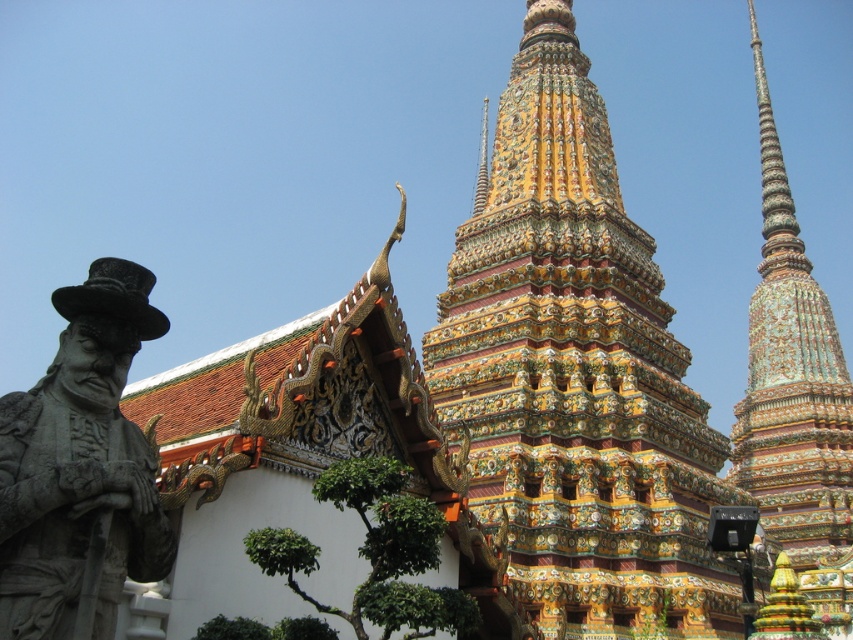
Question: Estimate the real-world distances between objects in this image. Which object is farther from the multicolored mosaic stupa at center?

Choices:
 (A) gray stone statue at left
 (B) multicolored mosaic temple at center

Answer: (A)

Question: Does multicolored mosaic temple at center appear over multicolored mosaic stupa at center?

Choices:
 (A) yes
 (B) no

Answer: (B)

Question: Which point is closer to the camera?

Choices:
 (A) multicolored mosaic temple at center
 (B) multicolored mosaic stupa at center

Answer: (A)

Question: Is gray stone statue at left wider than multicolored mosaic stupa at center?

Choices:
 (A) no
 (B) yes

Answer: (A)

Question: Which of the following is the closest to the observer?

Choices:
 (A) gray stone statue at left
 (B) multicolored mosaic temple at center

Answer: (A)

Question: Is multicolored mosaic temple at center above gray stone statue at left?

Choices:
 (A) no
 (B) yes

Answer: (B)